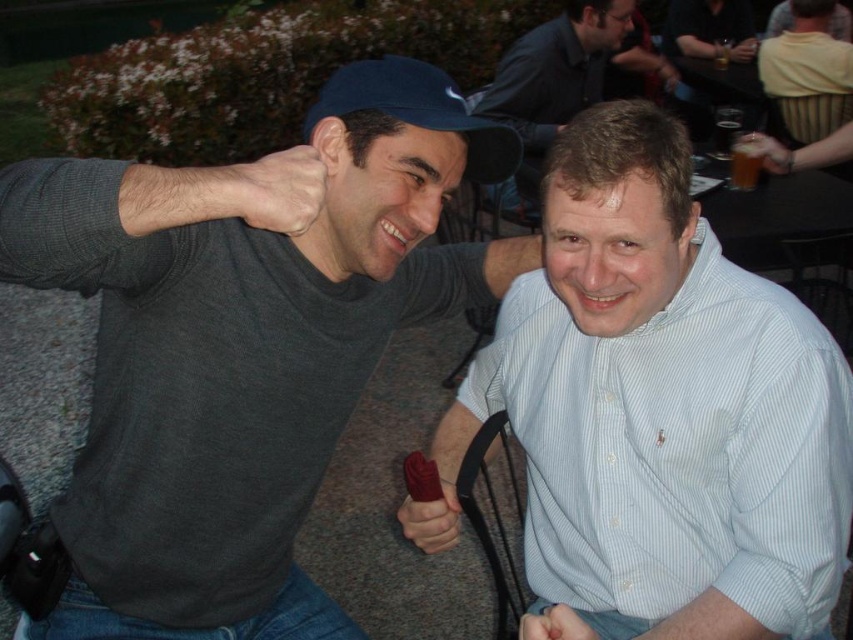
Who is more distant from viewer, (549, 131) or (462, 97)?

The point (549, 131) is more distant.

Is point (567, 17) closer to camera compared to point (410, 120)?

No, (567, 17) is further to viewer.

Is point (589, 92) farther from camera compared to point (404, 56)?

Yes, it is.

This screenshot has height=640, width=853. I want to click on light blue striped shirt at upper right, so tap(553, 77).

Can you confirm if white matte hand at upper center is shorter than matte brown glass at upper right?

Indeed, white matte hand at upper center has a lesser height compared to matte brown glass at upper right.

Which is below, white matte hand at upper center or matte brown glass at upper right?

white matte hand at upper center is below.

Is point (509, 250) closer to camera compared to point (746, 148)?

Yes, it is in front of point (746, 148).

Identify the location of white matte hand at upper center. The height and width of the screenshot is (640, 853). (509, 260).

Which of these two, skinny white hand at upper center or matte black hand at lower center, stands taller?

matte black hand at lower center is taller.

Does skinny white hand at upper center have a larger size compared to matte black hand at lower center?

Actually, skinny white hand at upper center might be smaller than matte black hand at lower center.

Who is more forward, (306, 176) or (444, 483)?

Point (306, 176) is more forward.

This screenshot has height=640, width=853. What are the coordinates of `skinny white hand at upper center` in the screenshot? It's located at (277, 189).